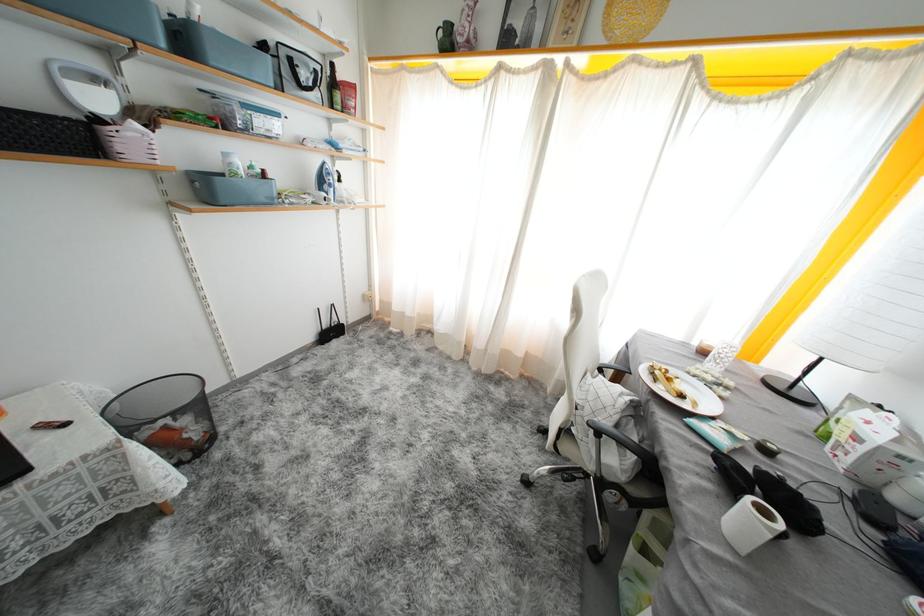
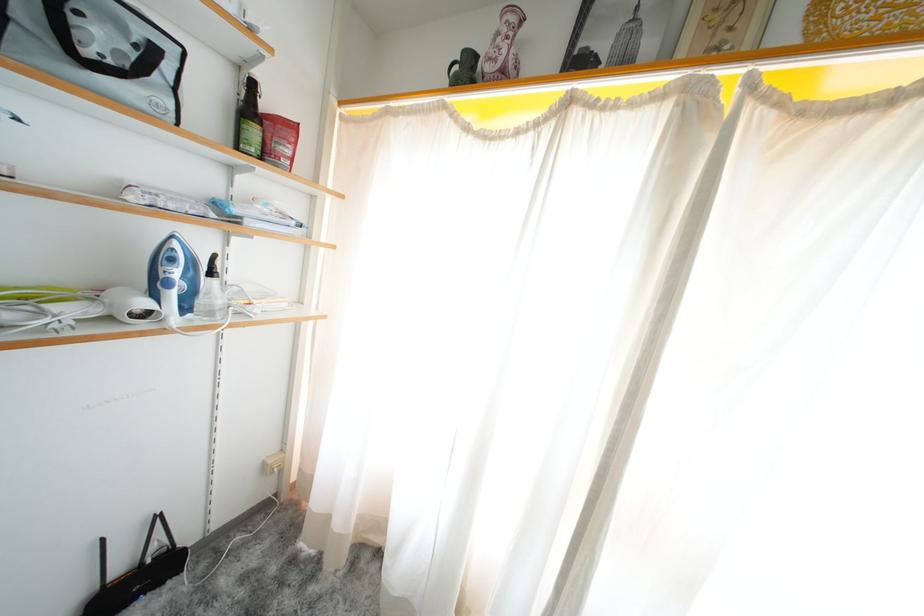
Question: The images are taken continuously from a first-person perspective. In which direction are you moving?

Choices:
 (A) Left
 (B) Right
 (C) Forward
 (D) Backward

Answer: (C)